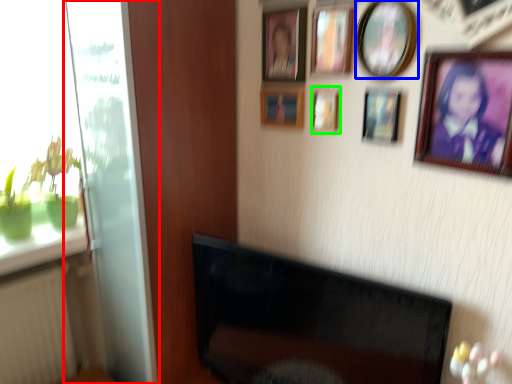
Question: Which is nearer to the glass door (highlighted by a red box)? picture frame (highlighted by a blue box) or picture frame (highlighted by a green box).

Choices:
 (A) picture frame
 (B) picture frame

Answer: (B)